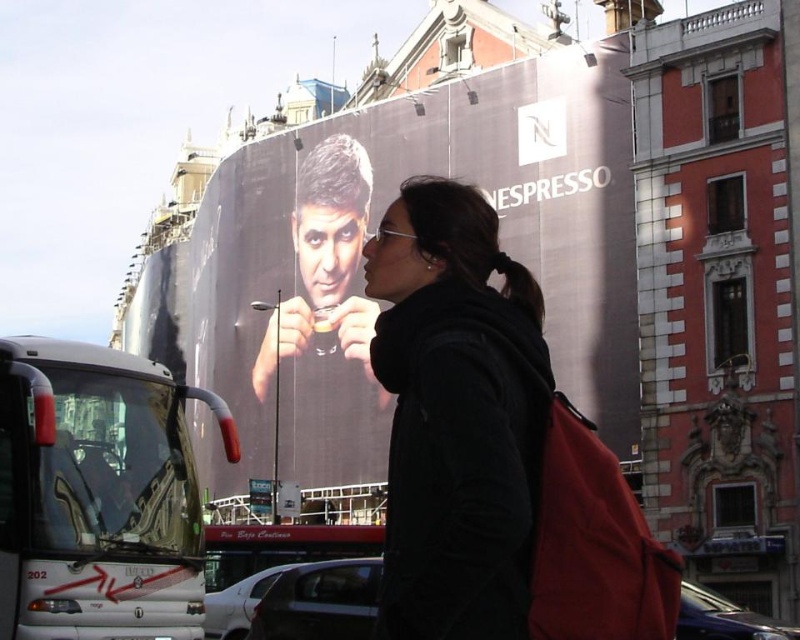
You are standing at the camera position and want to take a photo of the matte black billboard at center. Is the billboard within the camera range of 50 meters?

The matte black billboard at center is 57.35 meters away from the camera, which exceeds the 50 meters camera range. Therefore, the billboard is out of range.

You are standing in an urban area and see the point marked at coordinates (x=360, y=268). What object is located at that point?

The point at coordinates (x=360, y=268) indicates a matte black billboard at center.